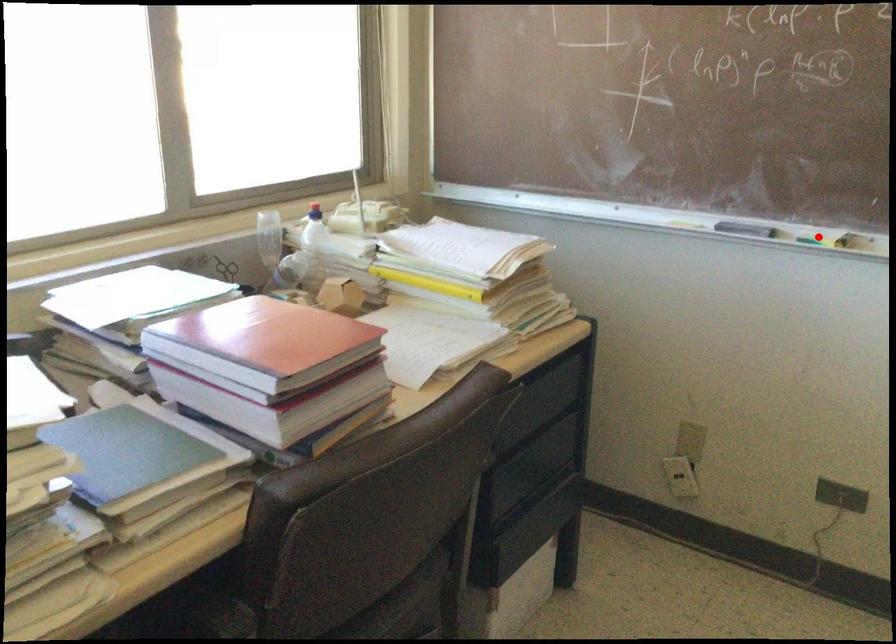
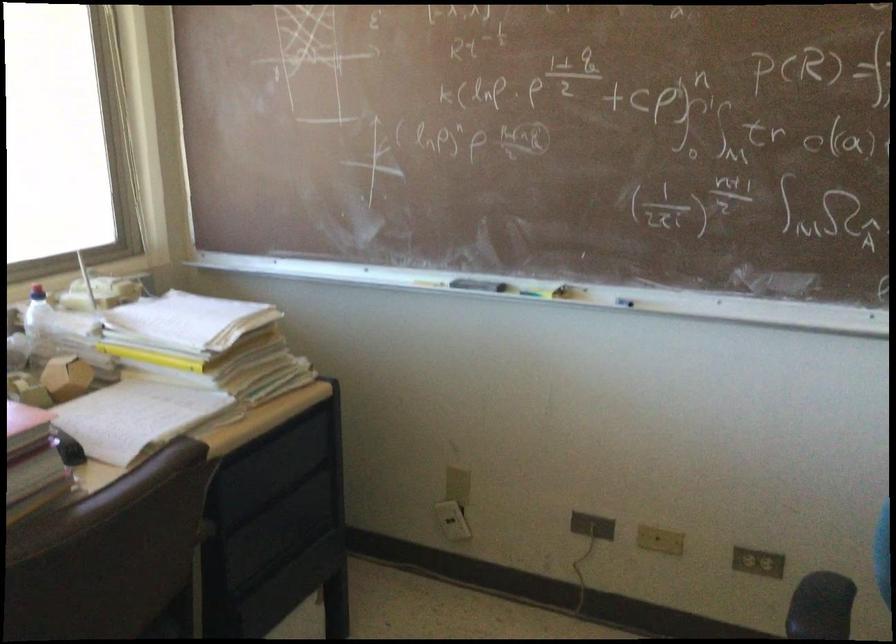
Where in the second image is the point corresponding to the highlighted location from the first image?

(538, 289)